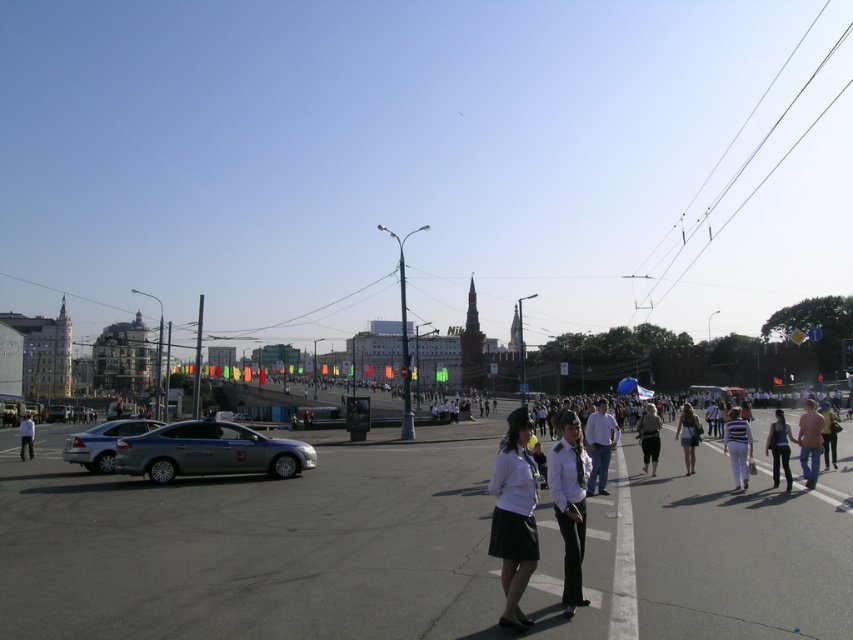
Can you confirm if smooth asphalt road at center is positioned below white uniform at center?

Indeed, smooth asphalt road at center is positioned under white uniform at center.

Can you confirm if smooth asphalt road at center is thinner than white uniform at center?

No, smooth asphalt road at center is not thinner than white uniform at center.

Locate an element on the screen. This screenshot has height=640, width=853. smooth asphalt road at center is located at coordinates [252, 548].

Who is higher up, white matte uniform at center or silver metallic sedan at center-left?

white matte uniform at center is above.

Can you confirm if white matte uniform at center is wider than silver metallic sedan at center-left?

No, white matte uniform at center is not wider than silver metallic sedan at center-left.

Measure the distance between white matte uniform at center and camera.

white matte uniform at center is 19.30 feet from camera.

Where is `white matte uniform at center`? Image resolution: width=853 pixels, height=640 pixels. white matte uniform at center is located at coordinates pyautogui.click(x=514, y=516).

Which is more to the right, white matte uniform at center or white striped shirt at center?

Positioned to the right is white striped shirt at center.

Does white matte uniform at center appear on the right side of white striped shirt at center?

Incorrect, white matte uniform at center is not on the right side of white striped shirt at center.

Image resolution: width=853 pixels, height=640 pixels. I want to click on white matte uniform at center, so click(x=514, y=516).